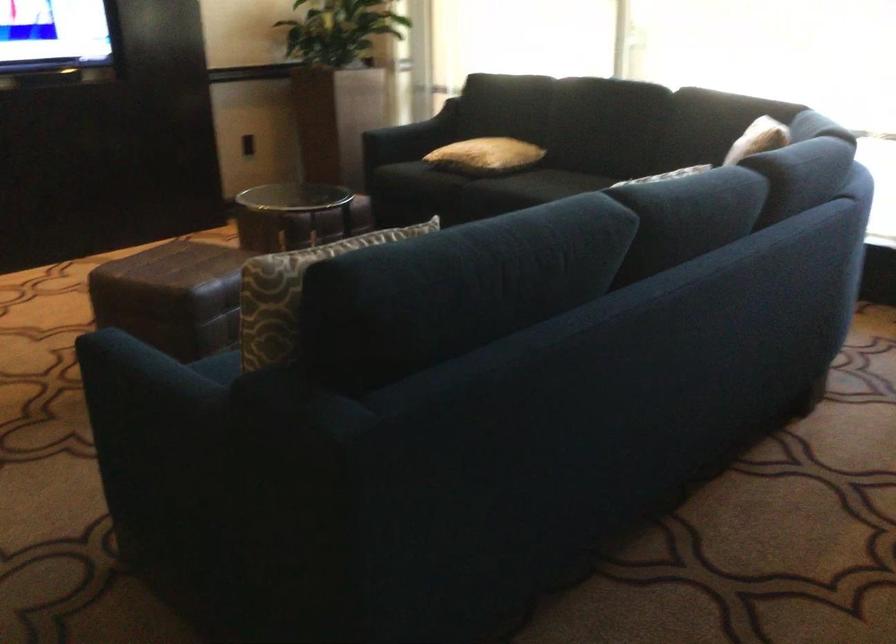
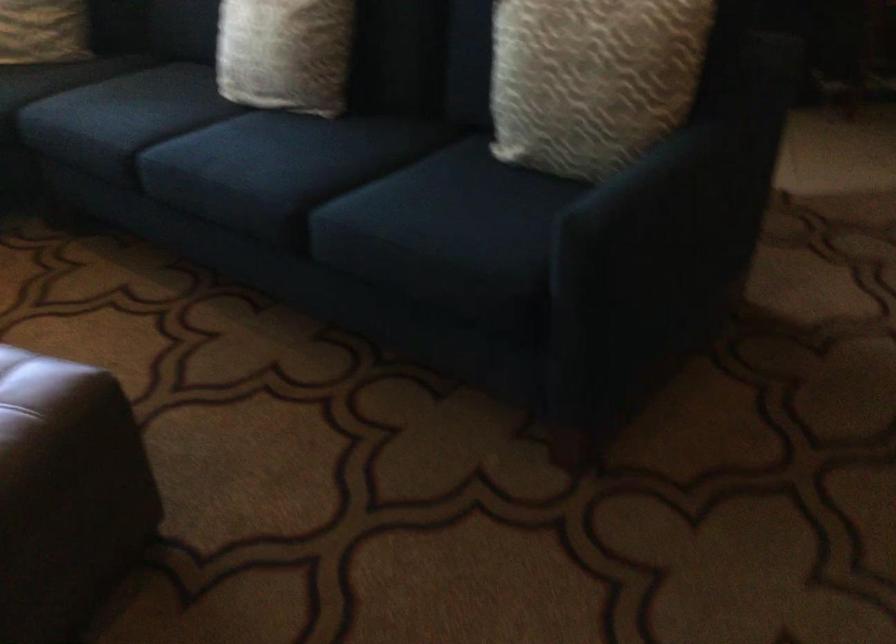
The point at (282, 308) is marked in the first image. Where is the corresponding point in the second image?

(591, 80)